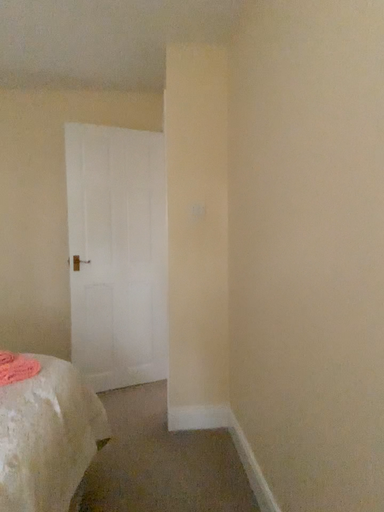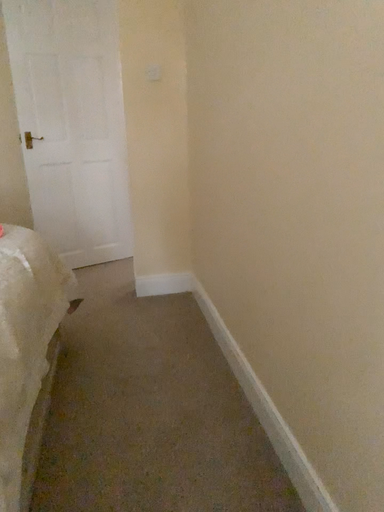
Question: How did the camera likely rotate when shooting the video?

Choices:
 (A) rotated downward
 (B) rotated upward

Answer: (A)